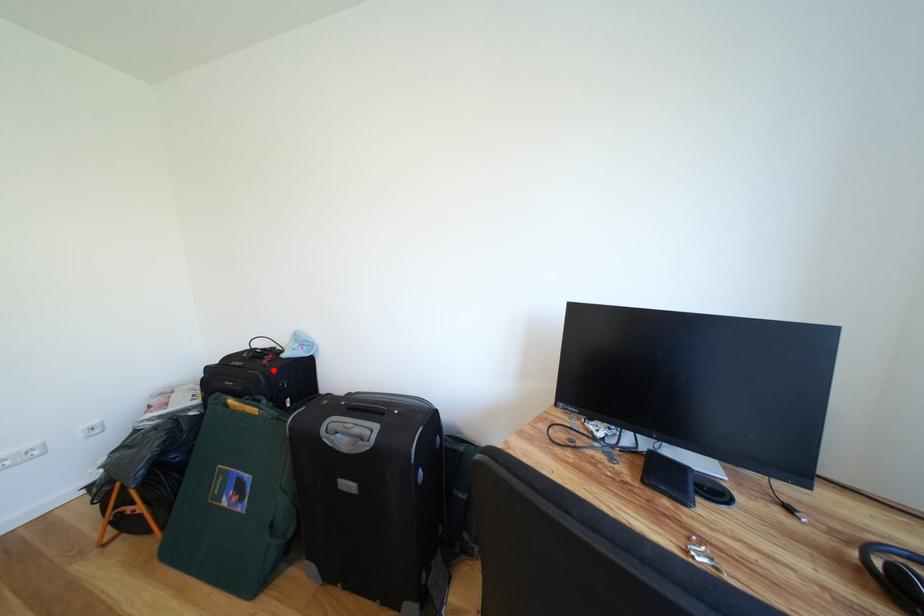
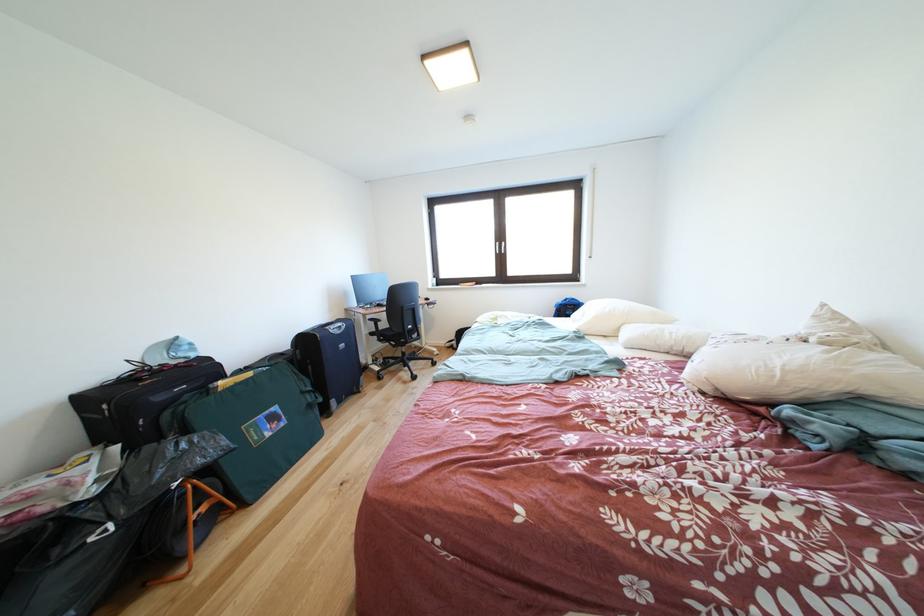
In the second image, find the point that corresponds to the highlighted location in the first image.

(200, 371)